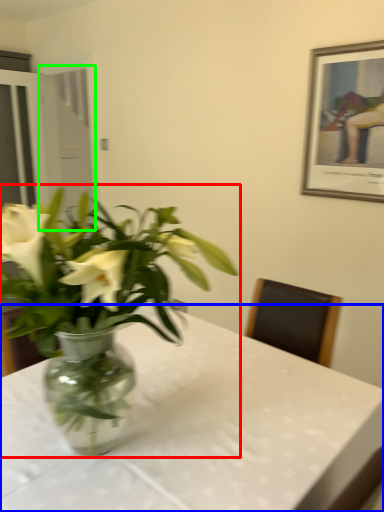
Question: Considering the real-world distances, which object is farthest from houseplant (highlighted by a red box)? table (highlighted by a blue box) or glass door (highlighted by a green box)?

Choices:
 (A) table
 (B) glass door

Answer: (B)